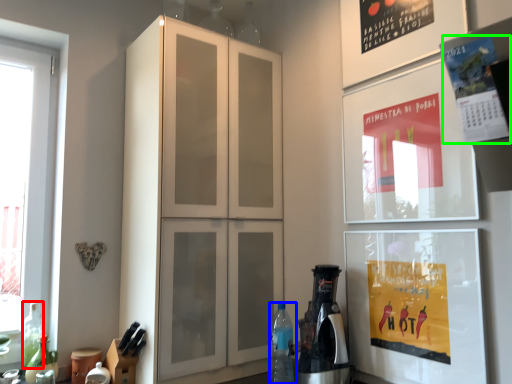
Question: Considering the real-world distances, which object is farthest from bottle (highlighted by a red box)? bottle (highlighted by a blue box) or poster (highlighted by a green box)?

Choices:
 (A) bottle
 (B) poster

Answer: (B)